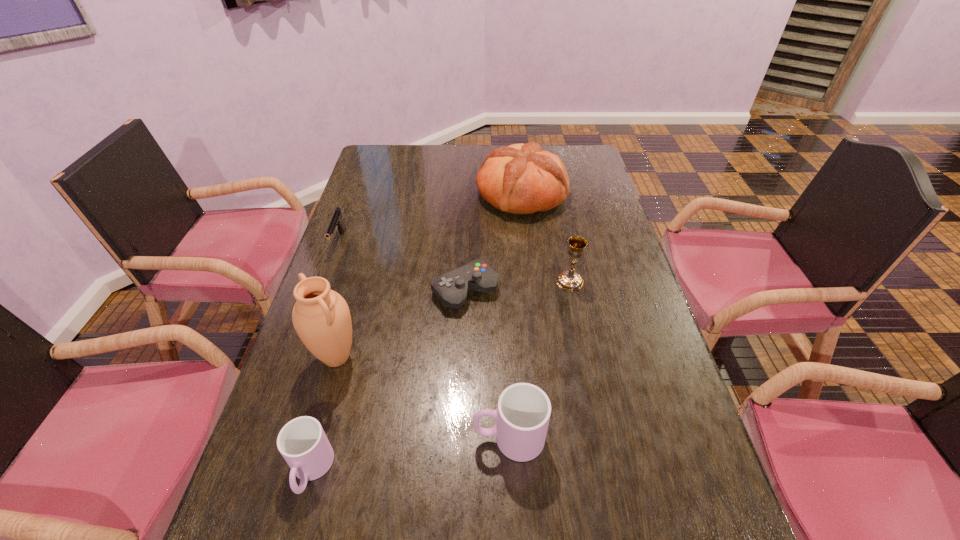
Identify the location of cup that is positioned at the left edge. Image resolution: width=960 pixels, height=540 pixels. (302, 442).

You are a GUI agent. You are given a task and a screenshot of the screen. Output one action in this format:
    pyautogui.click(x=<x>, y=<y>)
    Task: Click on the pistol located at the left edge
    
    Given the screenshot: What is the action you would take?
    pyautogui.click(x=336, y=221)

Where is `urn positioned at the left edge`? This screenshot has height=540, width=960. urn positioned at the left edge is located at coordinates (321, 317).

I want to click on bread present at the right edge, so click(x=523, y=179).

Locate an element on the screen. chalice present at the right edge is located at coordinates (569, 280).

This screenshot has height=540, width=960. I want to click on object that is at the near left corner, so click(x=302, y=442).

Locate an element on the screen. The width and height of the screenshot is (960, 540). object that is at the far right corner is located at coordinates (523, 179).

Where is `vacant area at the far edge`? vacant area at the far edge is located at coordinates (415, 165).

In the image, there is a desktop. Find the location of `vacant area at the near edge`. vacant area at the near edge is located at coordinates (437, 519).

What are the coordinates of `free space at the left edge of the desktop` in the screenshot? It's located at (357, 221).